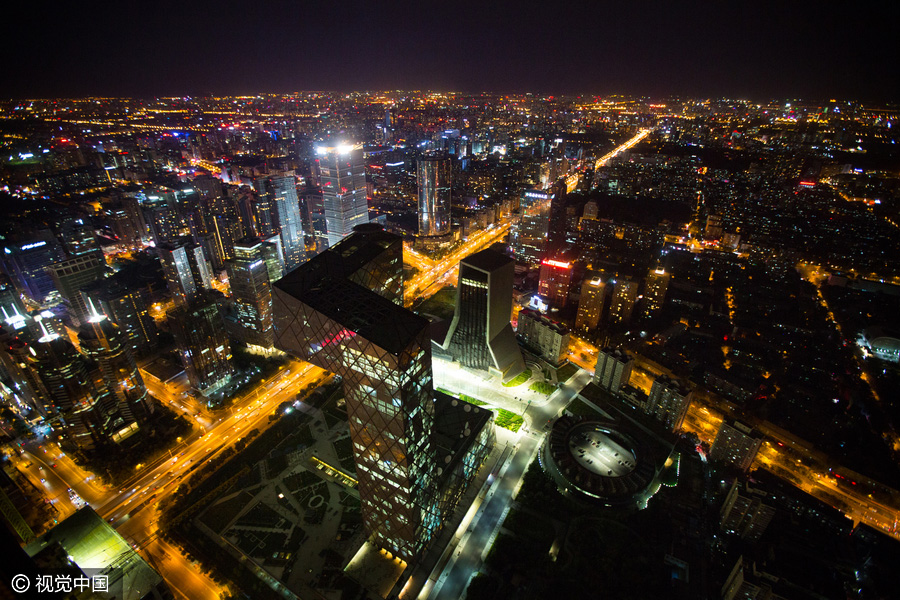
Image resolution: width=900 pixels, height=600 pixels. I want to click on orange glow of  lights, so click(244, 416), click(302, 364), click(459, 249), click(442, 265), click(771, 447).